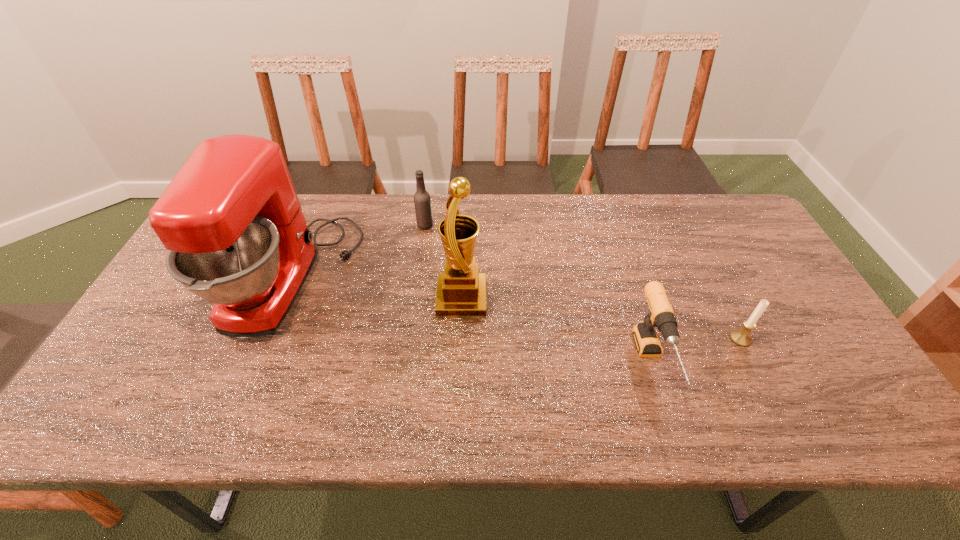
Identify the location of kitchen mixer that is at the far edge. (237, 237).

What are the coordinates of `beer bottle situated at the far edge` in the screenshot? It's located at (422, 201).

Find the location of a particular element. This screenshot has width=960, height=540. object present at the near edge is located at coordinates (661, 315).

In the image, there is a desktop. Where is `vacant space at the far edge`? The height and width of the screenshot is (540, 960). vacant space at the far edge is located at coordinates (680, 238).

At what (x,y) coordinates should I click in order to perform the action: click on free region at the near edge of the desktop. Please return your answer as a coordinate pair (x, y). The height and width of the screenshot is (540, 960). Looking at the image, I should click on (349, 429).

Locate an element on the screen. vacant space at the left edge of the desktop is located at coordinates (179, 303).

The image size is (960, 540). In the image, there is a desktop. In order to click on vacant space at the right edge in this screenshot , I will do `click(754, 256)`.

In the image, there is a desktop. Identify the location of vacant space at the near left corner. (111, 399).

At what (x,y) coordinates should I click in order to perform the action: click on vacant point at the far right corner. Please return your answer as a coordinate pair (x, y). This screenshot has height=540, width=960. Looking at the image, I should click on (699, 218).

This screenshot has height=540, width=960. I want to click on vacant area at the near right corner, so click(860, 397).